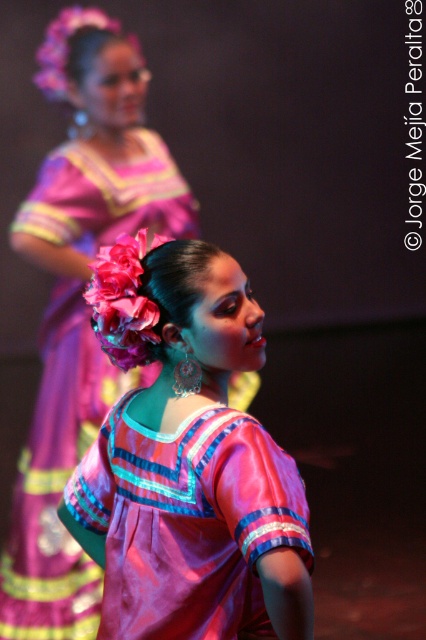
You are taking a photo of the silky pink blouse at center. The camera requires the object to be within the central 20x20 pixel area of the image frame. The image has a resolution of 1000x1000 pixels. Given the blouse is located at coordinates 0.719,0.441, will it be within the required area?

The silky pink blouse at center is located at coordinates (187, 460). The central 20x20 pixel area in a 1000x1000 image spans from 490 to 510 pixels on both axes. Converting the coordinates to pixels, 0.719 of 1000 is 719 pixels and 0.441 is 441 pixels. Since 719 and 441 are outside the 490 to 510 range, the blouse is not within the required central area.

You are a photographer adjusting your camera settings to focus on the silky pink blouse at center and the pink satin dress at center. Which object should you focus on first to ensure both are in focus?

The silky pink blouse at center is closer to the viewer than the pink satin dress at center, so you should focus on the silky pink blouse at center first to ensure both are in focus.